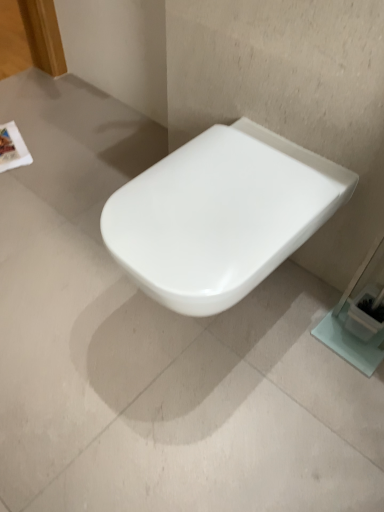
Where is `free space above white glossy toilet at center (from a real-world perspective)`? This screenshot has height=512, width=384. free space above white glossy toilet at center (from a real-world perspective) is located at coordinates pyautogui.click(x=230, y=172).